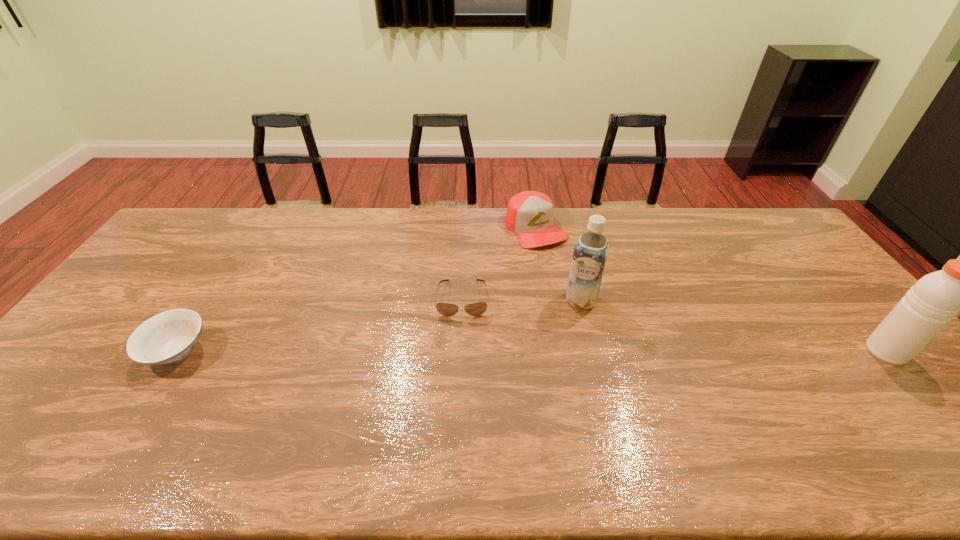
Image resolution: width=960 pixels, height=540 pixels. Identify the location of bowl. (170, 336).

Find the location of a particular element. The width and height of the screenshot is (960, 540). the second shortest object is located at coordinates (170, 336).

Image resolution: width=960 pixels, height=540 pixels. Identify the location of the rightmost object. (929, 305).

This screenshot has height=540, width=960. What are the coordinates of `the farthest object` in the screenshot? It's located at (530, 214).

What are the coordinates of `baseball cap` in the screenshot? It's located at (530, 214).

What are the coordinates of `soya milk` in the screenshot? It's located at (590, 253).

I want to click on the second object from left to right, so click(x=446, y=309).

Image resolution: width=960 pixels, height=540 pixels. Identify the location of sunglasses. (446, 309).

Identify the location of free spot located 0.060m on the right of the second shortest object. The height and width of the screenshot is (540, 960). (231, 351).

Identify the location of vacant space located on the front of the rightmost object. The width and height of the screenshot is (960, 540). (923, 393).